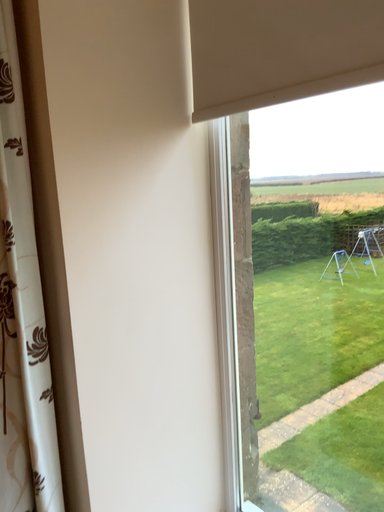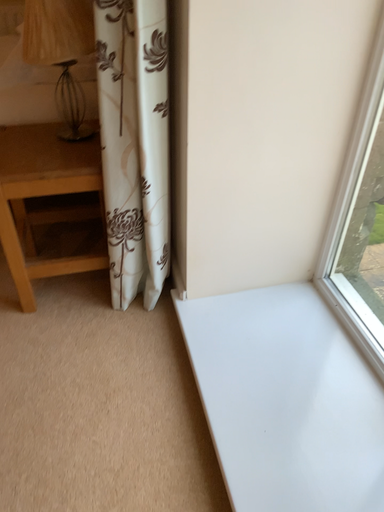
Question: How did the camera likely rotate when shooting the video?

Choices:
 (A) rotated left
 (B) rotated right

Answer: (A)